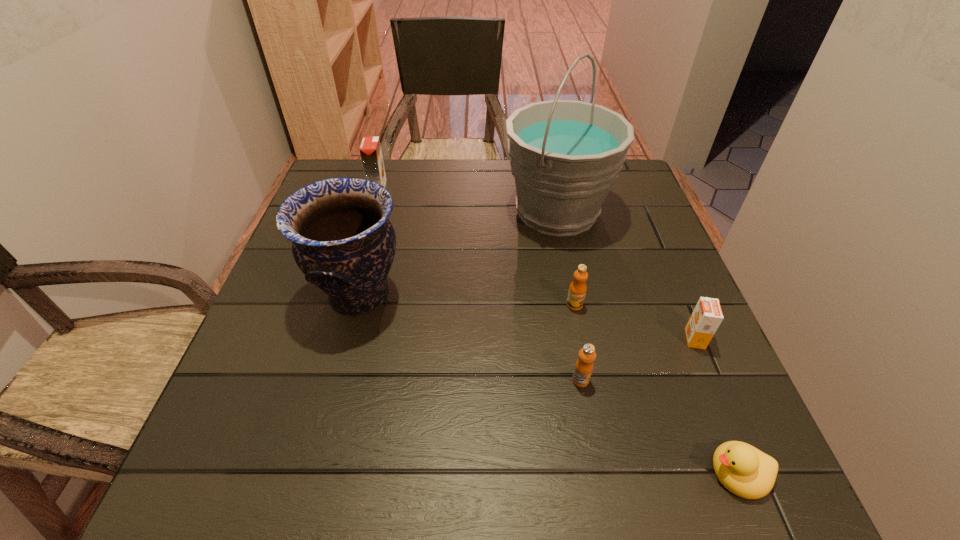
You are a GUI agent. You are given a task and a screenshot of the screen. Output one action in this format:
    pyautogui.click(x=<x>, y=<y>)
    Task: Click on the object positioned at the near edge
    This screenshot has width=960, height=540.
    Given the screenshot: What is the action you would take?
    pyautogui.click(x=744, y=470)

Identify the location of pottery at the left edge. Image resolution: width=960 pixels, height=540 pixels. (342, 240).

Image resolution: width=960 pixels, height=540 pixels. I want to click on orange juice present at the left edge, so click(x=370, y=149).

At what (x,y) coordinates should I click in order to perform the action: click on bucket situated at the right edge. Please return your answer as a coordinate pair (x, y). The height and width of the screenshot is (540, 960). Looking at the image, I should click on (564, 154).

Where is `orange juice located at the right edge`? orange juice located at the right edge is located at coordinates (706, 317).

You are a GUI agent. You are given a task and a screenshot of the screen. Output one action in this format:
    pyautogui.click(x=<x>, y=<y>)
    Task: Click on the duckling positioned at the right edge
    This screenshot has width=960, height=540.
    Given the screenshot: What is the action you would take?
    pyautogui.click(x=744, y=470)

Locate an element on the screen. object that is at the far left corner is located at coordinates (370, 149).

What are the coordinates of `object present at the far right corner` in the screenshot? It's located at (564, 154).

Where is `object present at the near right corner`? Image resolution: width=960 pixels, height=540 pixels. object present at the near right corner is located at coordinates (744, 470).

At what (x,y) coordinates should I click in order to perform the action: click on vacant region at the far edge of the desktop. Please return your answer as a coordinate pair (x, y). This screenshot has width=960, height=540. Looking at the image, I should click on (446, 191).